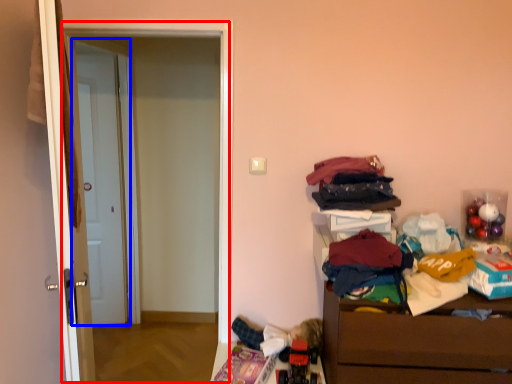
Question: Which of the following is the closest to the observer, screen door (highlighted by a red box) or door (highlighted by a blue box)?

Choices:
 (A) screen door
 (B) door

Answer: (A)